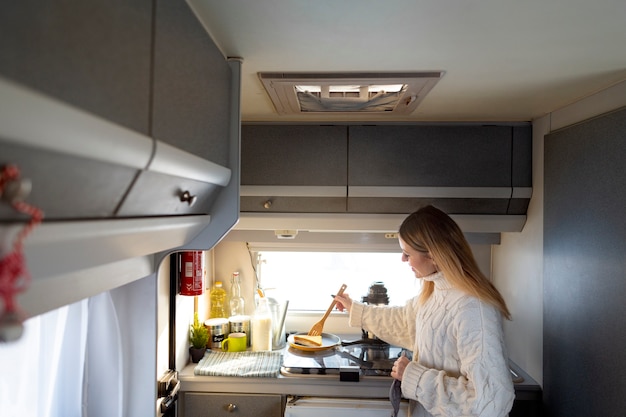
Identify the location of vent fan. Image resolution: width=626 pixels, height=417 pixels. (354, 109).